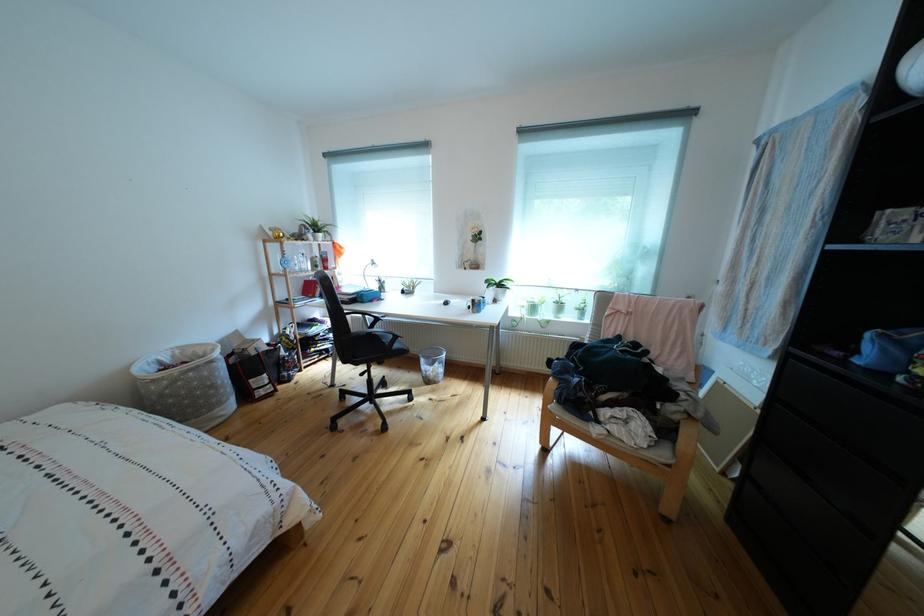
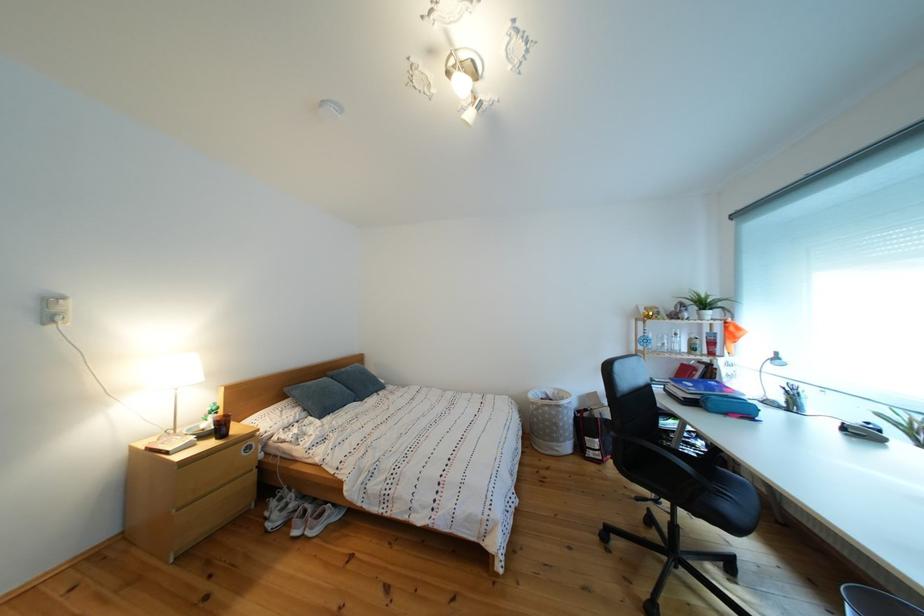
Question: The camera is either moving clockwise (left) or counter-clockwise (right) around the object. The first image is from the beginning of the video and the second image is from the end. Is the camera moving left or right when shooting the video?

Choices:
 (A) Left
 (B) Right

Answer: (B)